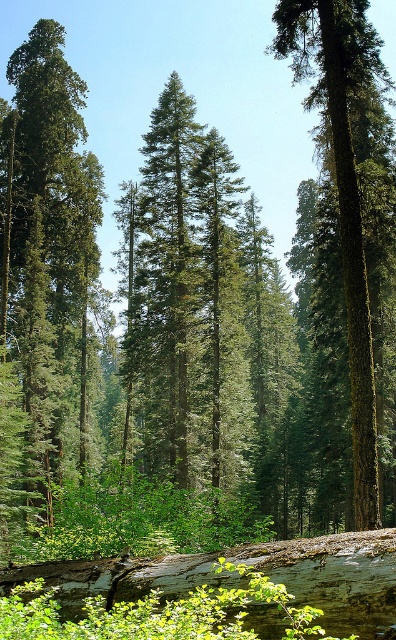
You are a hiker standing at the base of the green rough bark tree at left. You want to take a photo of it from a distance where it will appear as large as possible in your camera frame. Considering the camera can focus up to 50 feet, should you move closer or farther away from the tree to achieve this?

The green rough bark tree at left is currently 51.81 feet away from the camera. Since the camera can focus up to 50 feet, you should move closer to the tree to ensure it appears larger in the frame and within the camera focus range.

You are a hiker who wants to take a photo of both the green rough bark tree at left and the green mossy tree at center. Which tree should you stand closer to in order to capture both in the frame?

You should stand closer to the green mossy tree at center because the green rough bark tree at left is to the left of it, so positioning yourself near the center tree will help include both in the frame.